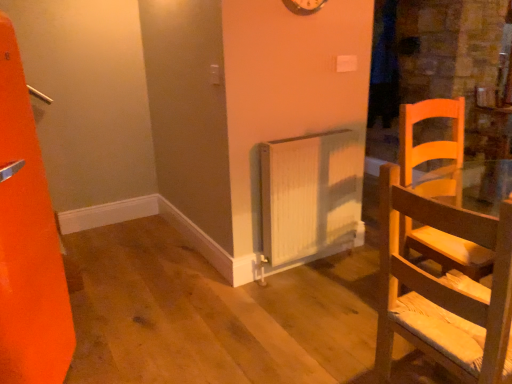
Question: From the image's perspective, relative to metallic silver clock at upper center, is white ribbed radiator at center above or below?

Choices:
 (A) above
 (B) below

Answer: (B)

Question: Relative to metallic silver clock at upper center, is white ribbed radiator at center in front or behind?

Choices:
 (A) behind
 (B) front

Answer: (A)

Question: Which of these objects is positioned farthest from the light wood chair at right?

Choices:
 (A) white ribbed radiator at center
 (B) metallic silver clock at upper center

Answer: (B)

Question: Which of these objects is positioned farthest from the metallic silver clock at upper center?

Choices:
 (A) light wood chair at right
 (B) white ribbed radiator at center

Answer: (A)